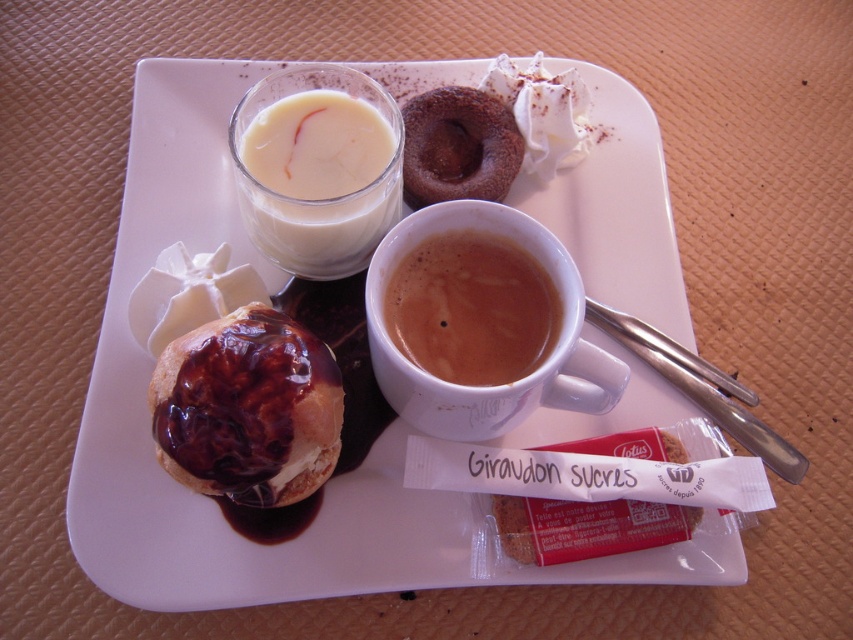
You are a chef who needs to place a new dessert on the matte white tray at center. However, there is already a chocolate cake at upper center. Based on their positions, which object is closer to you and should you adjust the placement?

The matte white tray at center is closer to the viewer than the chocolate cake at upper center. Therefore, you should adjust the placement by placing the new dessert on the matte white tray at center, which is closer and more accessible.

You are standing 1.03 meters away from the point at coordinates (189, 129). If you want to reach the chocolate donut at the top right corner of the tray, will you be able to do so without moving closer?

The point at coordinates (189, 129) is 1.03 meters away from you. Since the chocolate donut is located at the top right corner of the tray, which is near this point, you can reach it without needing to move closer as the distance is within arm reach.

You are a food delivery person who needs to place a new item between the white creamy liquid at upper left and the chocolate cake at upper center on the tray. The item you need to place is 3 inches wide. Can you fit it in the space between them?

The distance between the white creamy liquid at upper left and the chocolate cake at upper center is 5.07 inches. Since the item to place is 3 inches wide, there is enough space to fit it between them.